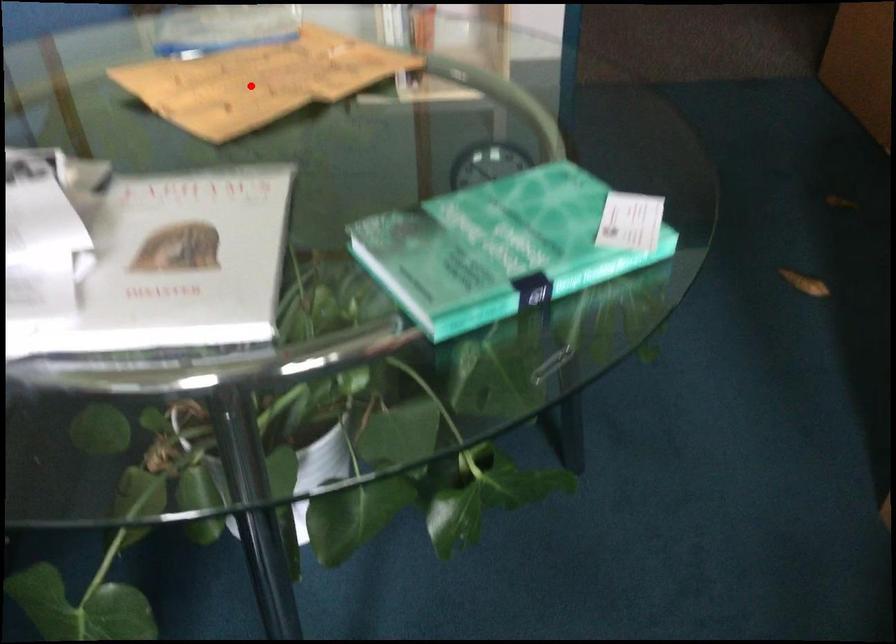
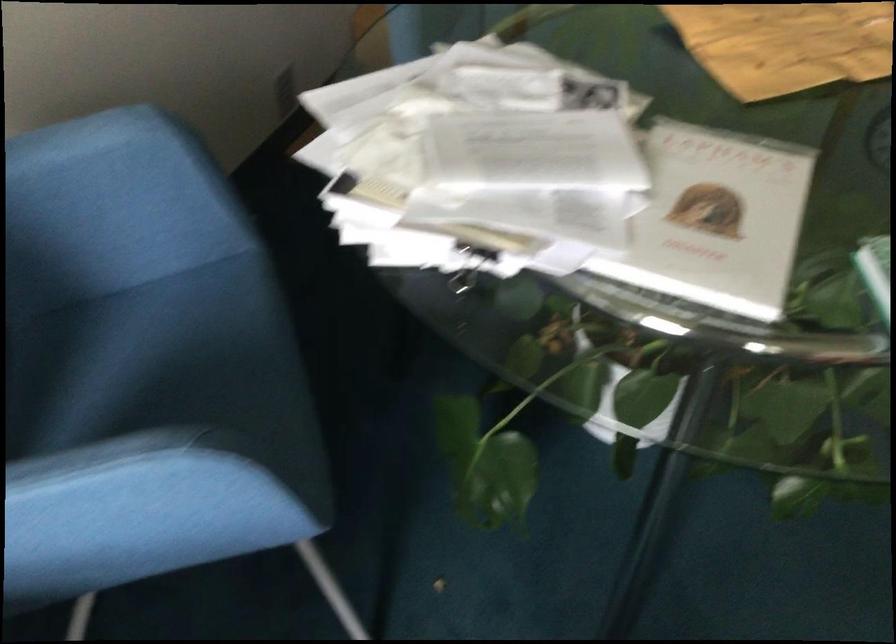
In the second image, find the point that corresponds to the highlighted location in the first image.

(786, 44)